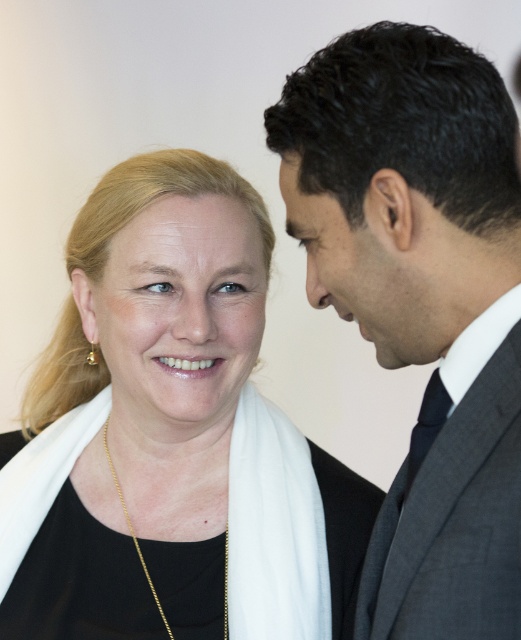
Question: Can you confirm if matte black scarf at left is positioned to the left of dark gray wool suit at right?

Choices:
 (A) yes
 (B) no

Answer: (A)

Question: Among these points, which one is nearest to the camera?

Choices:
 (A) (512, 529)
 (B) (144, 570)

Answer: (A)

Question: Which of these objects is positioned closest to the matte black scarf at left?

Choices:
 (A) gold chain necklace at center
 (B) navy blue silk tie at right
 (C) smooth skin at upper center
 (D) dark gray suit at right

Answer: (A)

Question: Which object is positioned farthest from the navy blue silk tie at right?

Choices:
 (A) gold chain necklace at center
 (B) smooth skin at upper center
 (C) dark gray suit at right

Answer: (A)

Question: Observing the image, what is the correct spatial positioning of matte black scarf at left in reference to dark gray suit at right?

Choices:
 (A) above
 (B) below

Answer: (B)

Question: Is dark gray wool suit at right below navy blue silk tie at right?

Choices:
 (A) yes
 (B) no

Answer: (A)